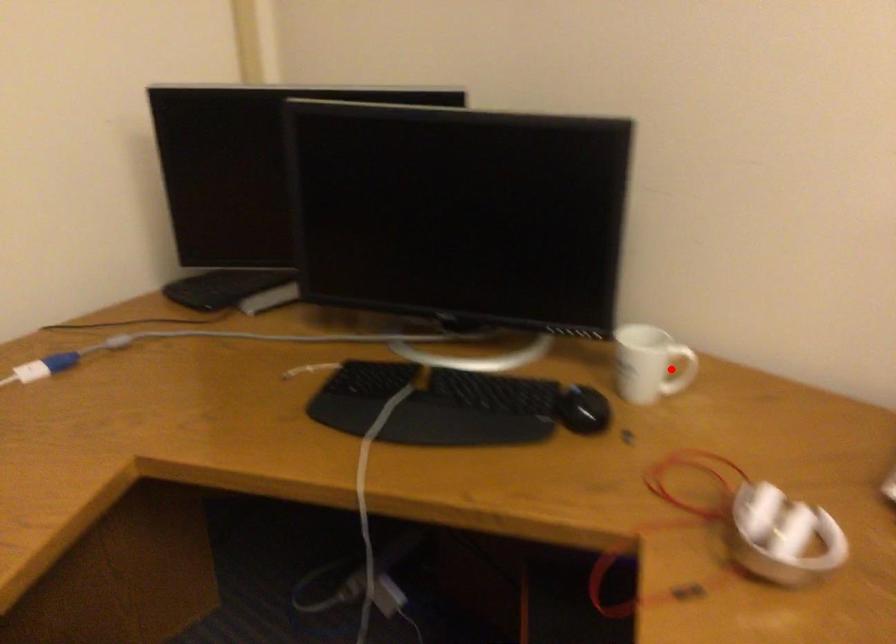
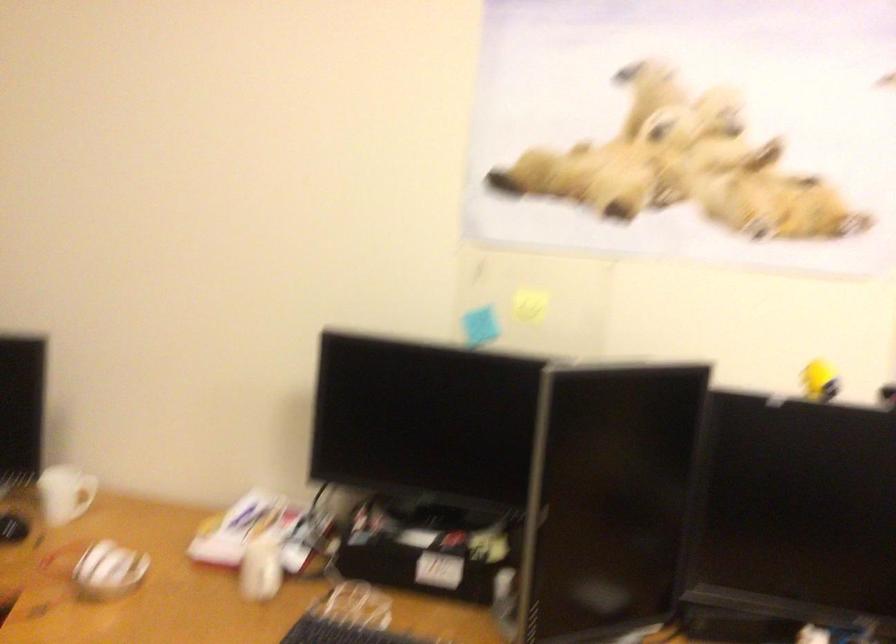
Question: I am providing you with two images of the same scene from different viewpoints. In image1, a red point is highlighted. Considering the same 3D point in image2, which of the following is correct?

Choices:
 (A) It is closer
 (B) It is farther

Answer: (B)